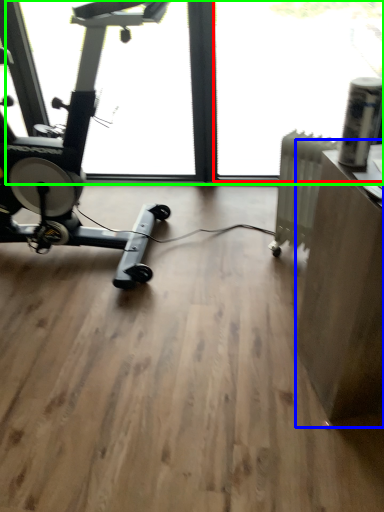
Question: Which object is the closest to the window screen (highlighted by a red box)? Choose among these: computer desk (highlighted by a blue box) or window screen (highlighted by a green box).

Choices:
 (A) computer desk
 (B) window screen

Answer: (B)